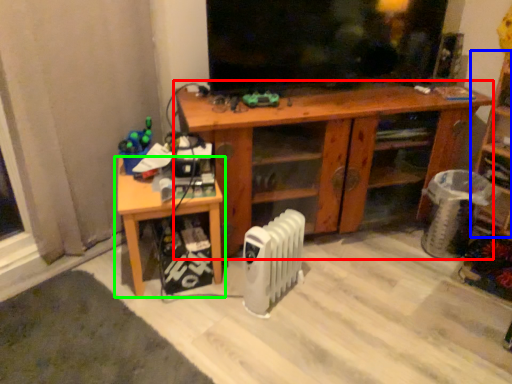
Question: Considering the real-world distances, which object is farthest from desk (highlighted by a red box)? shelf (highlighted by a blue box) or table (highlighted by a green box)?

Choices:
 (A) shelf
 (B) table

Answer: (A)